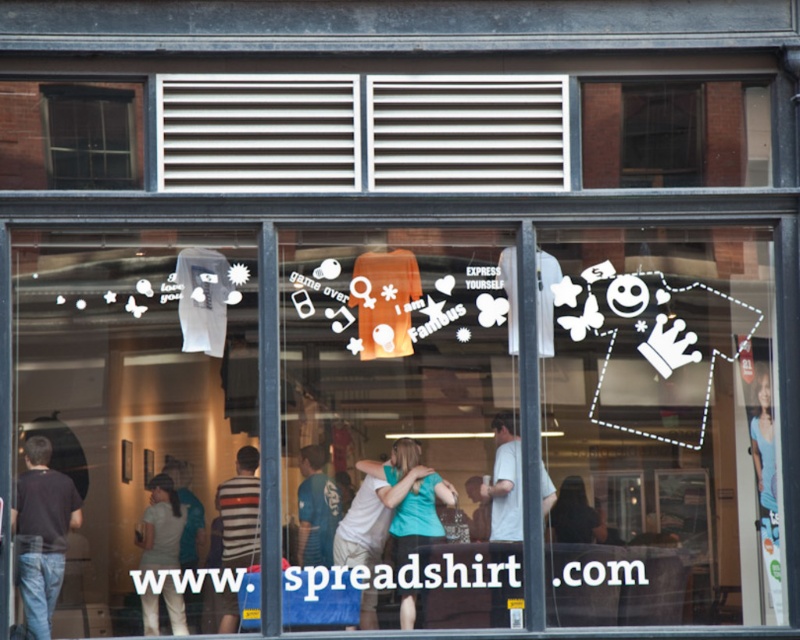
Question: Does white cotton shirt at lower left have a larger size compared to striped cotton shirt at lower left?

Choices:
 (A) no
 (B) yes

Answer: (A)

Question: Does dark blue shirt at left come behind teal fabric shirt at center?

Choices:
 (A) no
 (B) yes

Answer: (A)

Question: Which point is farther to the camera?

Choices:
 (A) blue fabric shirt at lower right
 (B) dark blue shirt at left

Answer: (A)

Question: Which point appears closest to the camera in this image?

Choices:
 (A) (520, 529)
 (B) (36, 513)

Answer: (B)

Question: Which is nearer to the white t-shirt at center?

Choices:
 (A) blue t-shirt at center
 (B) blue fabric shirt at lower right

Answer: (A)

Question: Does clear glass window at upper left appear over blue fabric shirt at lower right?

Choices:
 (A) no
 (B) yes

Answer: (B)